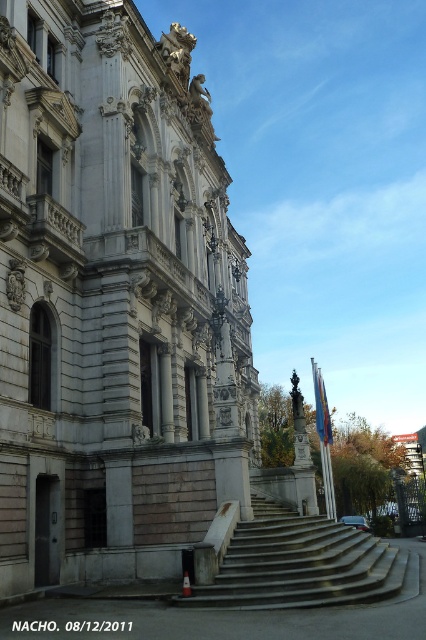
You are standing at the base of the concrete stairs at center leading to the white stone palace at center. If you were to look up, which structure would appear larger in your field of view?

The white stone palace at center would appear larger in your field of view because it is bigger than the concrete stairs at center.

You are standing in front of the grand neoclassical building. There is a point marked at coordinates (114, 300). What does this point most likely represent?

The point at (114, 300) indicates the white stone palace at center, which is the main structure of the building.

You are an architect assessing the building. Based on the image, which object between the white stone palace at center and the concrete stairs at center has a greater height?

The white stone palace at center is much taller than the concrete stairs at center.